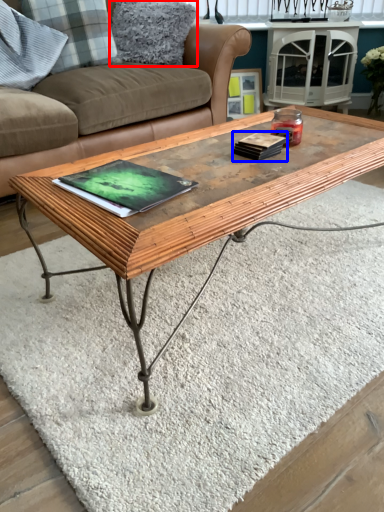
Question: Which object is further to the camera taking this photo, pillow (highlighted by a red box) or book (highlighted by a blue box)?

Choices:
 (A) pillow
 (B) book

Answer: (A)